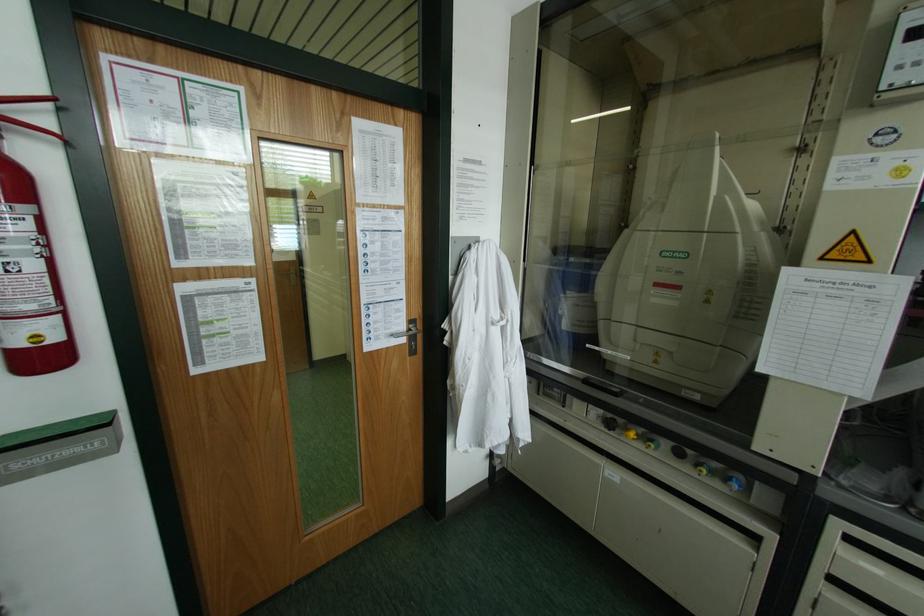
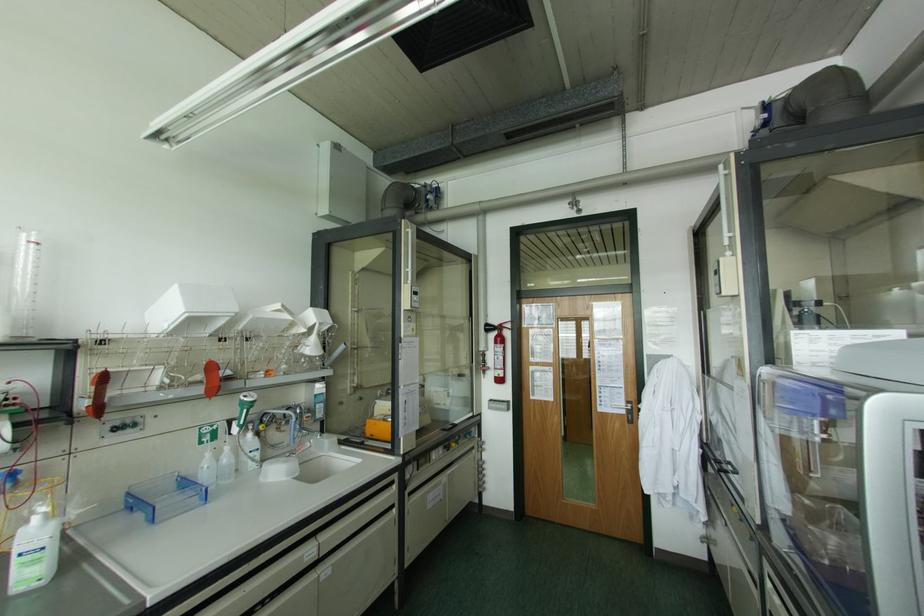
Where in the second image is the point corresponding to [43,120] from the first image?

(507, 325)